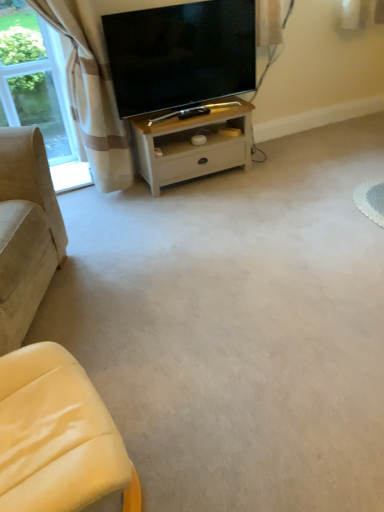
Describe the element at coordinates (26, 232) in the screenshot. I see `beige corduroy couch at left, arranged as the 2th studio couch when viewed from the right` at that location.

Locate an element on the screen. clear glass window at upper left is located at coordinates (32, 79).

Find the location of a particular element. matte black tv at upper center is located at coordinates (180, 54).

Looking at this image, from a real-world perspective, relative to matte black tv at upper center, is beige plaid curtain at upper left vertically above or below?

beige plaid curtain at upper left is situated lower than matte black tv at upper center in the real world.

Where is `television above the beige plaid curtain at upper left (from a real-world perspective)`? The width and height of the screenshot is (384, 512). television above the beige plaid curtain at upper left (from a real-world perspective) is located at coordinates (180, 54).

Which is in front, beige plaid curtain at upper left or matte black tv at upper center?

beige plaid curtain at upper left.

Is matte black tv at upper center further to the viewer compared to clear glass window at upper left?

That is False.

From the image's perspective, who appears lower, matte black tv at upper center or clear glass window at upper left?

clear glass window at upper left is shown below in the image.

The image size is (384, 512). I want to click on television that is above the clear glass window at upper left (from a real-world perspective), so click(x=180, y=54).

Based on the photo, considering the sizes of objects matte black tv at upper center and clear glass window at upper left in the image provided, who is taller, matte black tv at upper center or clear glass window at upper left?

clear glass window at upper left.

Considering the relative positions of beige corduroy couch at left, arranged as the 2th studio couch when viewed from the right, and yellow leather studio couch at lower left, which is the 1th studio couch from right to left, in the image provided, is beige corduroy couch at left, arranged as the 2th studio couch when viewed from the right, to the left of yellow leather studio couch at lower left, which is the 1th studio couch from right to left, from the viewer's perspective?

Yes, beige corduroy couch at left, arranged as the 2th studio couch when viewed from the right, is to the left of yellow leather studio couch at lower left, which is the 1th studio couch from right to left.

Locate an element on the screen. studio couch on the left of yellow leather studio couch at lower left, which appears as the second studio couch when viewed from the left is located at coordinates (26, 232).

From the image's perspective, relative to yellow leather studio couch at lower left, which is the 1th studio couch from right to left, is beige corduroy couch at left, arranged as the 2th studio couch when viewed from the right, above or below?

Clearly, from the image's perspective, beige corduroy couch at left, arranged as the 2th studio couch when viewed from the right, is above yellow leather studio couch at lower left, which is the 1th studio couch from right to left.

Image resolution: width=384 pixels, height=512 pixels. In order to click on curtain on the left of the white wood table at center in this screenshot , I will do `click(91, 93)`.

In terms of size, does white wood table at center appear bigger or smaller than beige plaid curtain at upper left?

Clearly, white wood table at center is smaller in size than beige plaid curtain at upper left.

Can you confirm if white wood table at center is shorter than beige plaid curtain at upper left?

Correct, white wood table at center is not as tall as beige plaid curtain at upper left.

From the image's perspective, relative to beige plaid curtain at upper left, is white wood table at center above or below?

white wood table at center is below beige plaid curtain at upper left.

Does yellow leather studio couch at lower left, which appears as the second studio couch when viewed from the left, lie behind white wood table at center?

No, yellow leather studio couch at lower left, which appears as the second studio couch when viewed from the left, is in front of white wood table at center.

From a real-world perspective, does yellow leather studio couch at lower left, which is the 1th studio couch from right to left, stand above white wood table at center?

Yes, from a real-world perspective, yellow leather studio couch at lower left, which is the 1th studio couch from right to left, is above white wood table at center.

Are yellow leather studio couch at lower left, which is the 1th studio couch from right to left, and white wood table at center located far from each other?

Yes, yellow leather studio couch at lower left, which is the 1th studio couch from right to left, is far from white wood table at center.

Would you say yellow leather studio couch at lower left, which appears as the second studio couch when viewed from the left, is outside white wood table at center?

Yes.

Find the location of a particular element. The image size is (384, 512). the 1st studio couch to the right when counting from the clear glass window at upper left is located at coordinates [26, 232].

Is beige corduroy couch at left, arranged as the 2th studio couch when viewed from the right, not inside clear glass window at upper left?

Yes, beige corduroy couch at left, arranged as the 2th studio couch when viewed from the right, is not within clear glass window at upper left.

Which of these two, beige corduroy couch at left, positioned as the 1th studio couch in left-to-right order, or clear glass window at upper left, stands shorter?

Standing shorter between the two is beige corduroy couch at left, positioned as the 1th studio couch in left-to-right order.

Consider the image. From their relative heights in the image, would you say white wood table at center is taller or shorter than yellow leather studio couch at lower left, which appears as the second studio couch when viewed from the left?

white wood table at center is shorter than yellow leather studio couch at lower left, which appears as the second studio couch when viewed from the left.

Is white wood table at center positioned before yellow leather studio couch at lower left, which appears as the second studio couch when viewed from the left?

No.

What's the angular difference between white wood table at center and yellow leather studio couch at lower left, which appears as the second studio couch when viewed from the left,'s facing directions?

white wood table at center and yellow leather studio couch at lower left, which appears as the second studio couch when viewed from the left, are facing 101 degrees away from each other.

Consider the image. Can you confirm if white wood table at center is thinner than yellow leather studio couch at lower left, which is the 1th studio couch from right to left?

Correct, the width of white wood table at center is less than that of yellow leather studio couch at lower left, which is the 1th studio couch from right to left.

The image size is (384, 512). I want to click on curtain that is below the matte black tv at upper center (from the image's perspective), so click(x=91, y=93).

Locate an element on the screen. This screenshot has height=512, width=384. television above the clear glass window at upper left (from the image's perspective) is located at coordinates tap(180, 54).

Based on their spatial positions, is beige corduroy couch at left, arranged as the 2th studio couch when viewed from the right, or yellow leather studio couch at lower left, which is the 1th studio couch from right to left, further from clear glass window at upper left?

yellow leather studio couch at lower left, which is the 1th studio couch from right to left, is positioned further to the anchor clear glass window at upper left.

Considering their positions, is yellow leather studio couch at lower left, which appears as the second studio couch when viewed from the left, positioned further to clear glass window at upper left than matte black tv at upper center?

yellow leather studio couch at lower left, which appears as the second studio couch when viewed from the left.

In the scene shown: From the image, which object appears to be nearer to clear glass window at upper left, white wood table at center or yellow leather studio couch at lower left, which appears as the second studio couch when viewed from the left?

white wood table at center is closer to clear glass window at upper left.

Based on their spatial positions, is white wood table at center or clear glass window at upper left further from beige plaid curtain at upper left?

Based on the image, clear glass window at upper left appears to be further to beige plaid curtain at upper left.

Estimate the real-world distances between objects in this image. Which object is further from white wood table at center, beige corduroy couch at left, arranged as the 2th studio couch when viewed from the right, or matte black tv at upper center?

Based on the image, beige corduroy couch at left, arranged as the 2th studio couch when viewed from the right, appears to be further to white wood table at center.

Consider the image. Looking at the image, which one is located further to white wood table at center, yellow leather studio couch at lower left, which is the 1th studio couch from right to left, or matte black tv at upper center?

The object further to white wood table at center is yellow leather studio couch at lower left, which is the 1th studio couch from right to left.

Which object lies further to the anchor point beige plaid curtain at upper left, white wood table at center or yellow leather studio couch at lower left, which is the 1th studio couch from right to left?

yellow leather studio couch at lower left, which is the 1th studio couch from right to left, is positioned further to the anchor beige plaid curtain at upper left.

Looking at the image, which one is located further to beige plaid curtain at upper left, clear glass window at upper left or matte black tv at upper center?

Among the two, clear glass window at upper left is located further to beige plaid curtain at upper left.

Where is `television between clear glass window at upper left and white wood table at center from left to right`? The width and height of the screenshot is (384, 512). television between clear glass window at upper left and white wood table at center from left to right is located at coordinates (180, 54).

At what (x,y) coordinates should I click in order to perform the action: click on curtain between beige corduroy couch at left, arranged as the 2th studio couch when viewed from the right, and matte black tv at upper center in the front-back direction. Please return your answer as a coordinate pair (x, y). Looking at the image, I should click on (91, 93).

Image resolution: width=384 pixels, height=512 pixels. I want to click on curtain between clear glass window at upper left and yellow leather studio couch at lower left, which appears as the second studio couch when viewed from the left, in the up-down direction, so click(91, 93).

The height and width of the screenshot is (512, 384). I want to click on television between beige corduroy couch at left, positioned as the 1th studio couch in left-to-right order, and white wood table at center, along the z-axis, so click(x=180, y=54).